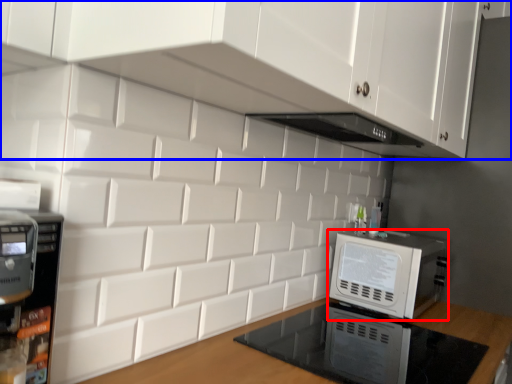
Question: Which point is further to the camera, home appliance (highlighted by a red box) or cabinetry (highlighted by a blue box)?

Choices:
 (A) home appliance
 (B) cabinetry

Answer: (A)